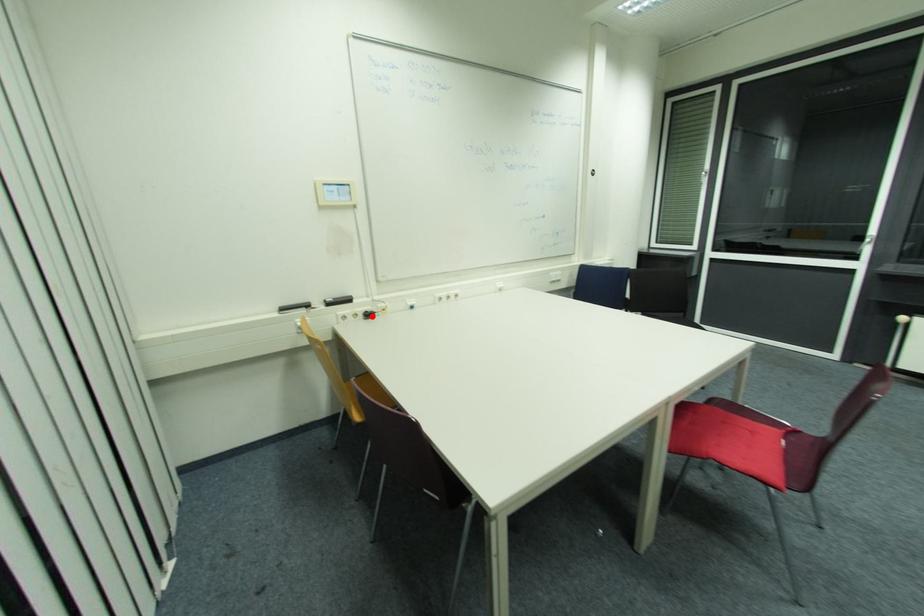
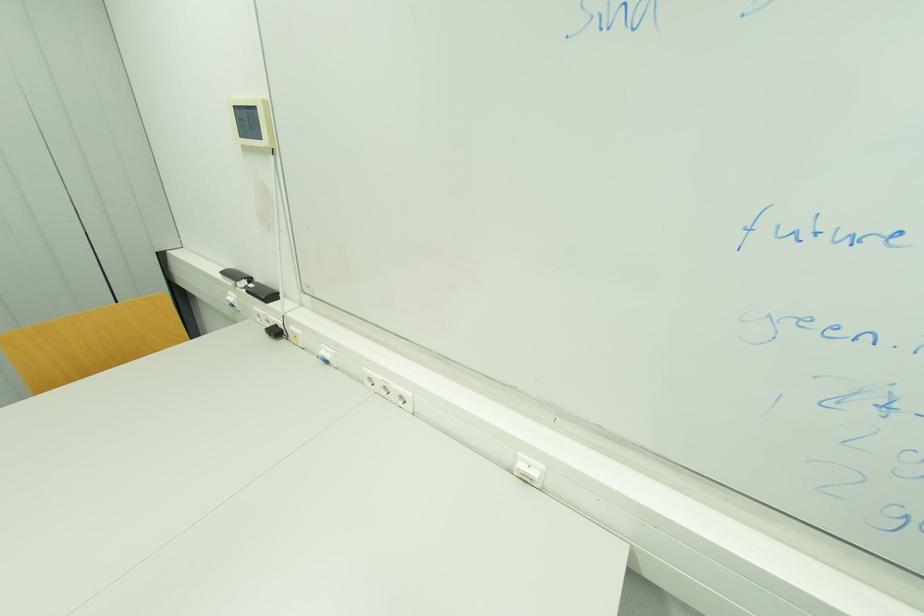
In the second image, find the point that corresponds to the highlighted location in the first image.

(281, 333)